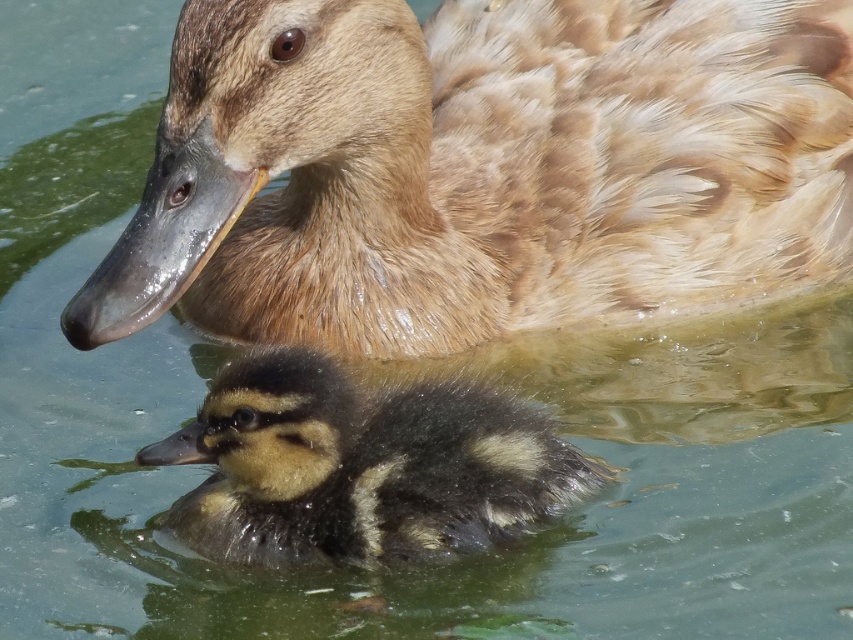
Question: Which point appears farthest from the camera in this image?

Choices:
 (A) (355, 534)
 (B) (494, 22)

Answer: (B)

Question: Does brown feathered duck at upper center lie behind black fuzzy duckling at center?

Choices:
 (A) yes
 (B) no

Answer: (A)

Question: Is brown feathered duck at upper center below black fuzzy duckling at center?

Choices:
 (A) no
 (B) yes

Answer: (A)

Question: Does brown feathered duck at upper center come in front of black fuzzy duckling at center?

Choices:
 (A) no
 (B) yes

Answer: (A)